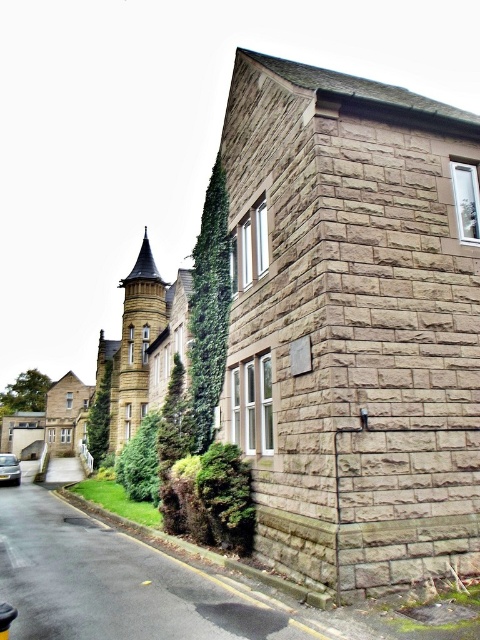
Does green ivy at left have a larger size compared to silver metallic car at lower left?

Yes, green ivy at left is bigger than silver metallic car at lower left.

Does green ivy at left appear on the right side of silver metallic car at lower left?

Indeed, green ivy at left is positioned on the right side of silver metallic car at lower left.

Who is more distant from viewer, (x=93, y=452) or (x=19, y=476)?

Point (x=93, y=452)

What are the coordinates of `green ivy at left` in the screenshot? It's located at (99, 417).

Which of these two, green leafy ivy at center or green ivy at left, stands taller?

Standing taller between the two is green ivy at left.

Who is positioned more to the left, green leafy ivy at center or green ivy at left?

green ivy at left

Between point (162, 468) and point (96, 422), which one is positioned behind?

The point (96, 422) is behind.

At what (x,y) coordinates should I click in order to perform the action: click on green leafy ivy at center. Please return your answer as a coordinate pair (x, y). The width and height of the screenshot is (480, 640). Looking at the image, I should click on (173, 422).

Between green leafy ivy at lower left and green ivy at left, which one appears on the left side from the viewer's perspective?

green ivy at left

This screenshot has height=640, width=480. Find the location of `green leafy ivy at lower left`. green leafy ivy at lower left is located at coordinates (x=140, y=461).

Locate an element on the screen. green leafy ivy at lower left is located at coordinates (140, 461).